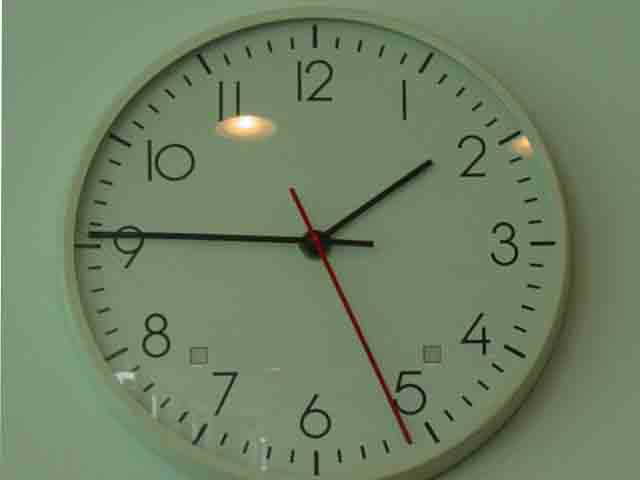
You are a GUI agent. You are given a task and a screenshot of the screen. Output one action in this format:
    pyautogui.click(x=<x>, y=<y>)
    Task: Click on the clock minute hand
    
    Given the screenshot: What is the action you would take?
    pyautogui.click(x=97, y=234), pyautogui.click(x=164, y=232), pyautogui.click(x=237, y=235), pyautogui.click(x=292, y=241), pyautogui.click(x=305, y=241), pyautogui.click(x=333, y=240), pyautogui.click(x=367, y=243)